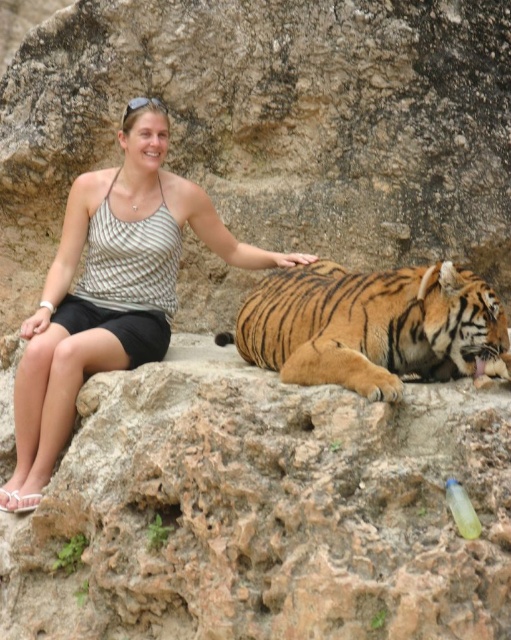
Question: Among these objects, which one is nearest to the camera?

Choices:
 (A) translucent yellow bottle at lower right
 (B) striped fabric tank top at center

Answer: (A)

Question: Is the position of orange striped tiger at lower right less distant than that of translucent yellow bottle at lower right?

Choices:
 (A) no
 (B) yes

Answer: (A)

Question: Is striped fabric tank top at center positioned behind translucent yellow bottle at lower right?

Choices:
 (A) no
 (B) yes

Answer: (B)

Question: Among these objects, which one is farthest from the camera?

Choices:
 (A) orange striped tiger at lower right
 (B) striped fabric tank top at center
 (C) translucent yellow bottle at lower right

Answer: (B)

Question: Does orange striped tiger at lower right have a larger size compared to translucent yellow bottle at lower right?

Choices:
 (A) yes
 (B) no

Answer: (A)

Question: Considering the real-world distances, which object is farthest from the translucent yellow bottle at lower right?

Choices:
 (A) orange striped tiger at lower right
 (B) striped fabric tank top at center

Answer: (B)